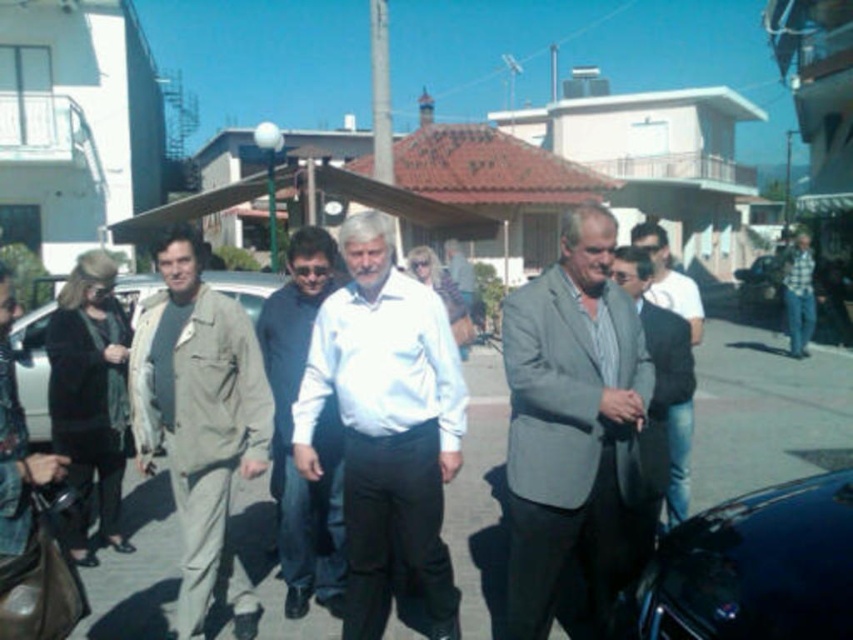
Question: Which point is closer to the camera?

Choices:
 (A) (676, 426)
 (B) (12, 490)

Answer: (B)

Question: Which of these objects is positioned farthest from the beige fabric jacket at left?

Choices:
 (A) white smooth shirt at center
 (B) shiny black car at lower right
 (C) denim jeans at right

Answer: (C)

Question: Is gray suit at center to the left of beige fabric jacket at left from the viewer's perspective?

Choices:
 (A) yes
 (B) no

Answer: (B)

Question: Can you confirm if dark gray asphalt at center is positioned to the left of tan fabric jacket at left?

Choices:
 (A) no
 (B) yes

Answer: (A)

Question: Can you confirm if tan fabric jacket at left is positioned above white cotton shirt at center?

Choices:
 (A) no
 (B) yes

Answer: (A)

Question: Based on their relative distances, which object is nearer to the white cotton shirt at center?

Choices:
 (A) beige fabric jacket at left
 (B) shiny black car at lower right
 (C) tan fabric jacket at left

Answer: (C)